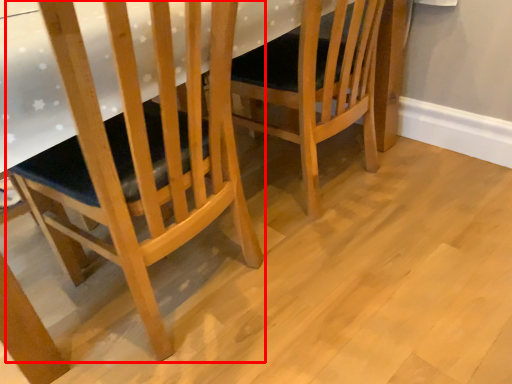
Question: Considering the relative positions of chair (annotated by the red box) and chair in the image provided, where is chair (annotated by the red box) located with respect to the staircase?

Choices:
 (A) right
 (B) left

Answer: (B)